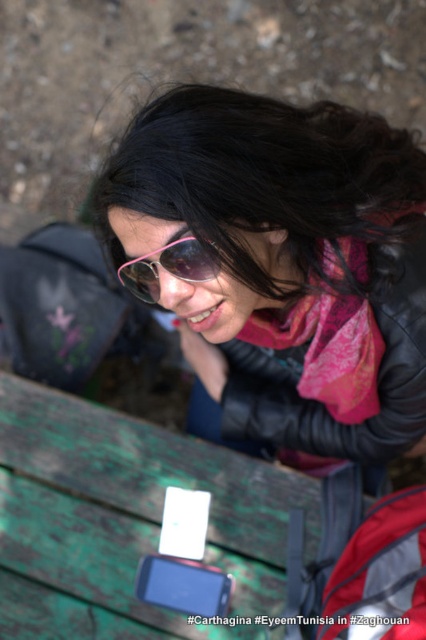
Who is shorter, leather jacket at center or pink reflective sunglasses at center?

Standing shorter between the two is pink reflective sunglasses at center.

Can you confirm if leather jacket at center is positioned above pink reflective sunglasses at center?

Actually, leather jacket at center is below pink reflective sunglasses at center.

Identify the location of leather jacket at center. Image resolution: width=426 pixels, height=640 pixels. (336, 364).

Between matte black jacket at center and pink reflective sunglasses at center, which one has more height?

matte black jacket at center

Is point (282, 189) positioned before point (158, 301)?

That is True.

The image size is (426, 640). What do you see at coordinates (281, 264) in the screenshot?
I see `matte black jacket at center` at bounding box center [281, 264].

Where is `matte black jacket at center`? The image size is (426, 640). matte black jacket at center is located at coordinates (281, 264).

Can you confirm if matte black jacket at center is taller than leather jacket at center?

Yes.

Is matte black jacket at center thinner than leather jacket at center?

In fact, matte black jacket at center might be wider than leather jacket at center.

Is point (296, 236) more distant than point (340, 429)?

That is False.

Locate an element on the screen. matte black jacket at center is located at coordinates (281, 264).